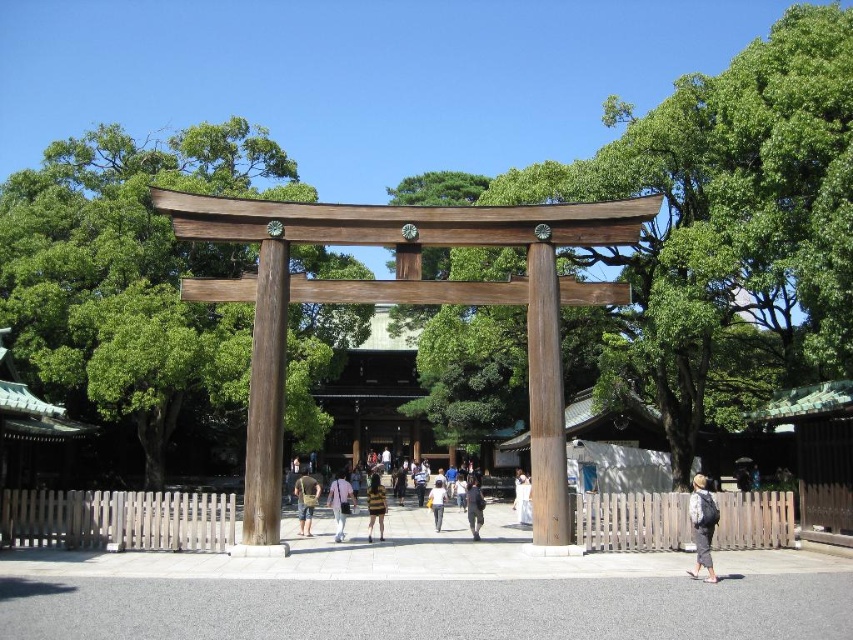
You are standing in front of a traditional Japanese torii gate and see a light brown backpack at lower right and a striped fabric shirt at center. Which object is covering the other one?

The light brown backpack at lower right is positioned over striped fabric shirt at center, so it is covering the other object.

You are standing in front of the torii gate and want to take a photo. There are two points marked on the gate at coordinates point (352, 497) and point (437, 483). Which point is closer to you when you take the photo?

Point (352, 497) is closer to the camera than point (437, 483), so it will appear closer to you in the photo.

You are standing in front of the torii gate and want to pick up both the light brown backpack at lower right and the striped fabric shirt at center. Which item should you reach for first based on their positions?

The light brown backpack at lower right is closer to the viewer than the striped fabric shirt at center, so you should reach for the light brown backpack at lower right first.